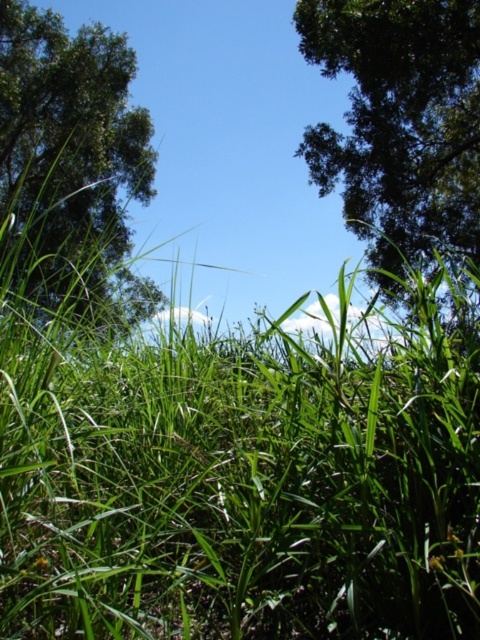
From the picture: You are standing in a field of tall grass looking up at two large green leafy trees. Which tree would appear closer to you, the green leafy tree at upper right or the green leafy tree at upper left?

The green leafy tree at upper right appears closer because it is smaller in size compared to the green leafy tree at upper left, which is larger and therefore farther away.

You are standing in the middle of the tall grass looking up. Which tree, the green leafy tree at upper right or the green leafy tree at upper left, is closer to you?

The green leafy tree at upper right is closer to you because it is positioned over the green leafy tree at upper left, meaning it is in front of it from your viewpoint.